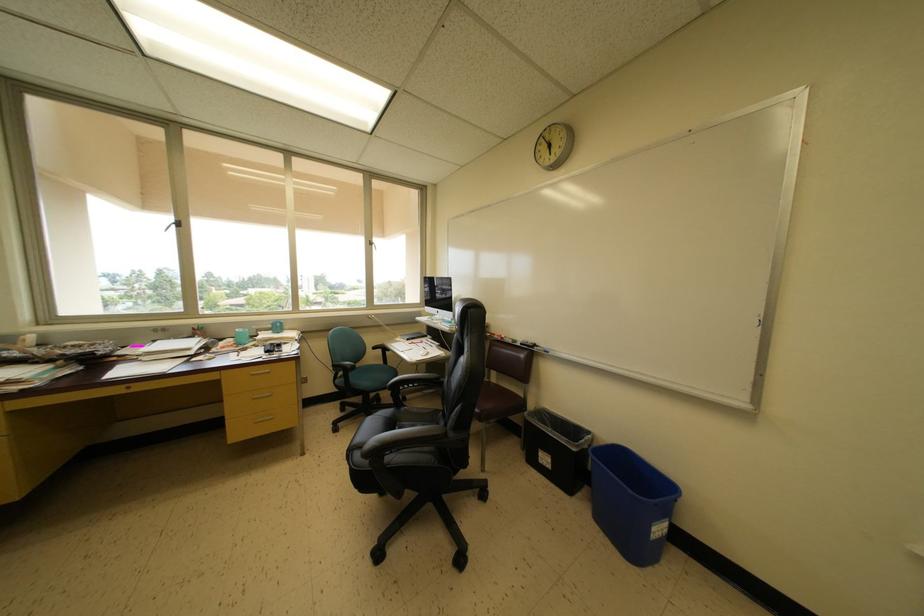
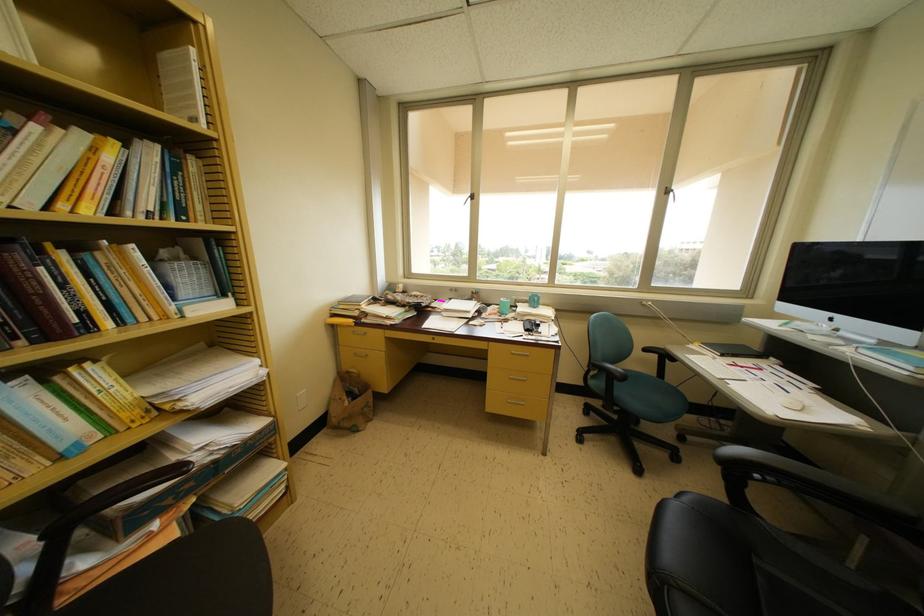
In the second image, find the point that corresponds to point 282,331 in the first image.

(538, 306)